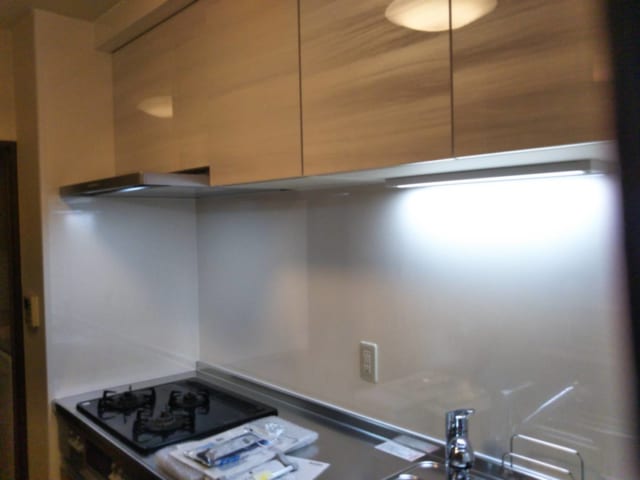
Where is `faucet`? Image resolution: width=640 pixels, height=480 pixels. faucet is located at coordinates (457, 432).